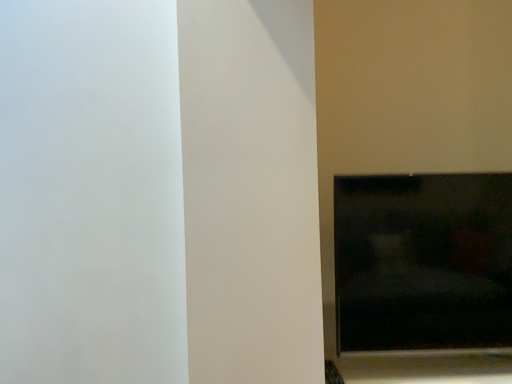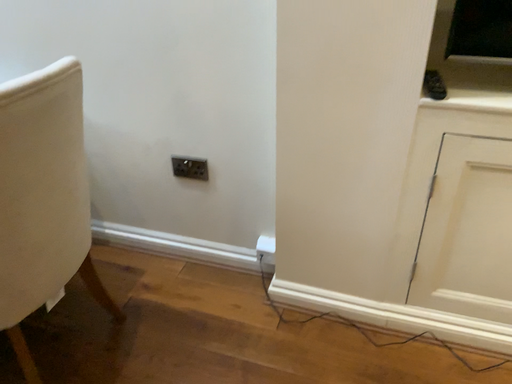
Question: Which way did the camera rotate in the video?

Choices:
 (A) rotated upward
 (B) rotated downward

Answer: (B)